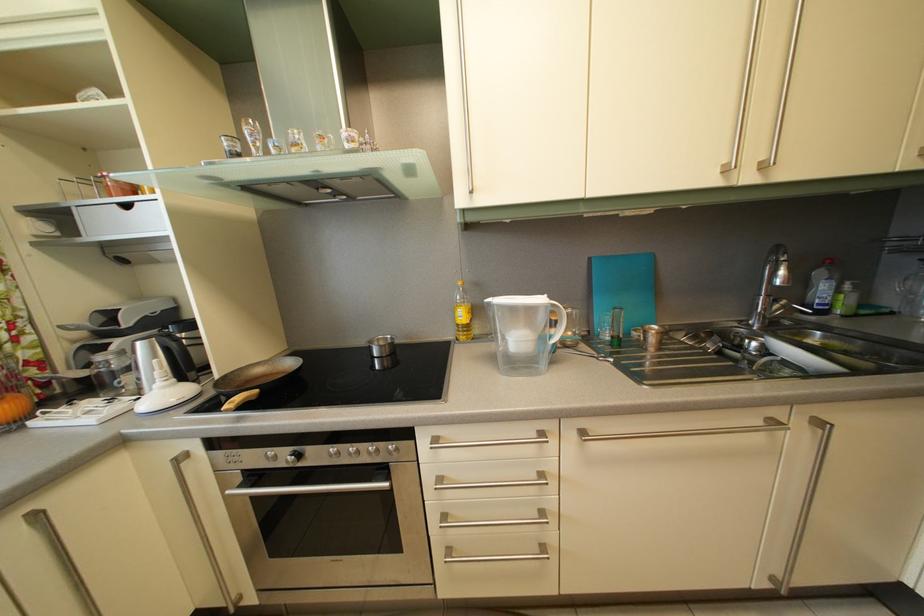
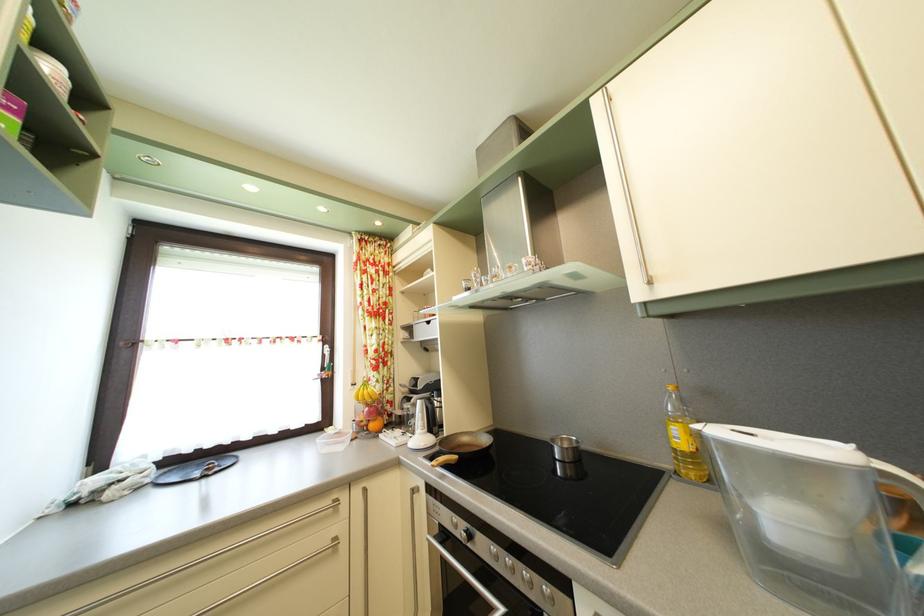
Question: The camera is either moving clockwise (left) or counter-clockwise (right) around the object. The first image is from the beginning of the video and the second image is from the end. Is the camera moving left or right when shooting the video?

Choices:
 (A) Left
 (B) Right

Answer: (B)